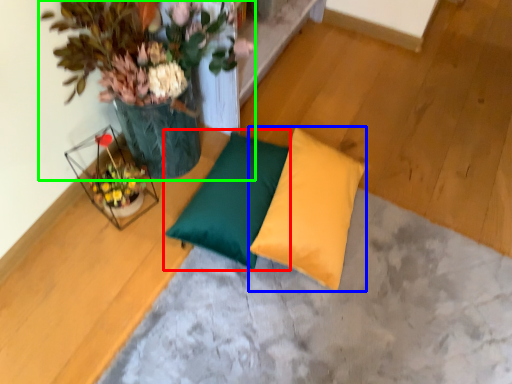
Question: Which is nearer to the pillow (highlighted by a red box)? pillow (highlighted by a blue box) or houseplant (highlighted by a green box).

Choices:
 (A) pillow
 (B) houseplant

Answer: (A)